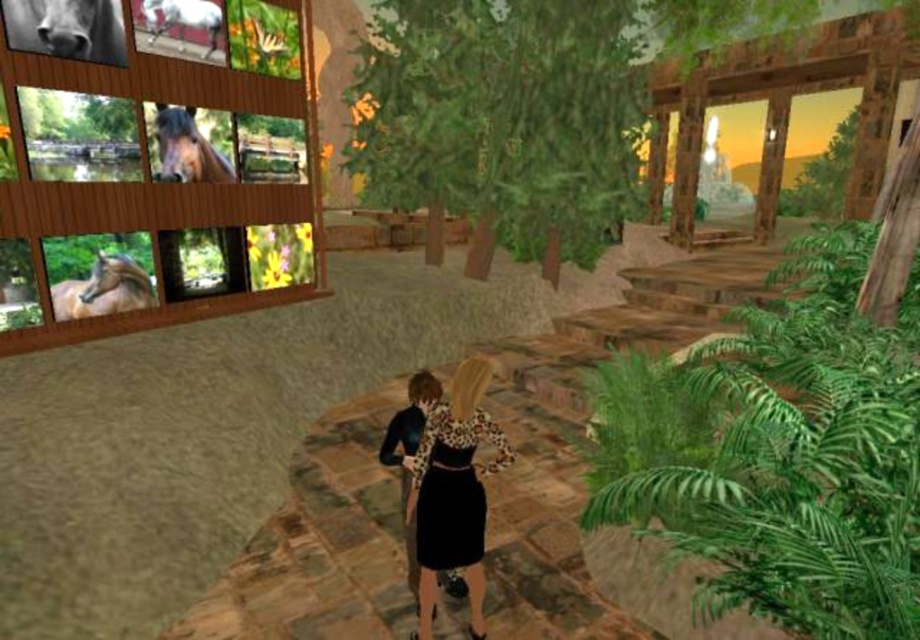
Looking at this image, you are standing at the entrance of a virtual environment and see the green leafy trees at center and the white glossy horse at upper left. Which object is positioned to the right of the other?

The green leafy trees at center is to the right of white glossy horse at upper left.

Consider the image. You are a character in a game who needs to jump from the white glossy horse at upper left to the green leafy trees at center. Can you make the jump if your maximum jump distance is 5 meters?

The green leafy trees at center and white glossy horse at upper left are 5.99 meters apart from each other. Since your maximum jump distance is 5 meters, you cannot make the jump.

You are standing at the entrance of this virtual environment and see the green leafy plant at right and the brown glossy horse at upper left. Which object is located to the right of the other?

The green leafy plant at right is positioned on the right side of brown glossy horse at upper left.